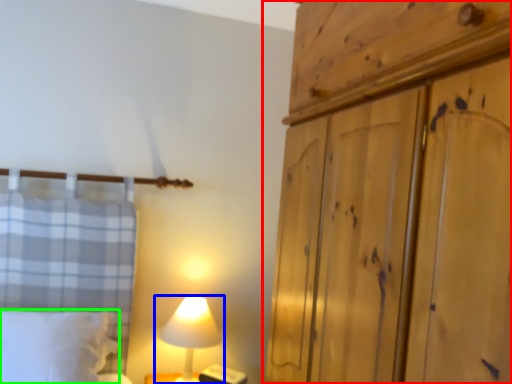
Question: Considering the real-world distances, which object is farthest from cupboard (highlighted by a red box)? lamp (highlighted by a blue box) or pillow (highlighted by a green box)?

Choices:
 (A) lamp
 (B) pillow

Answer: (B)